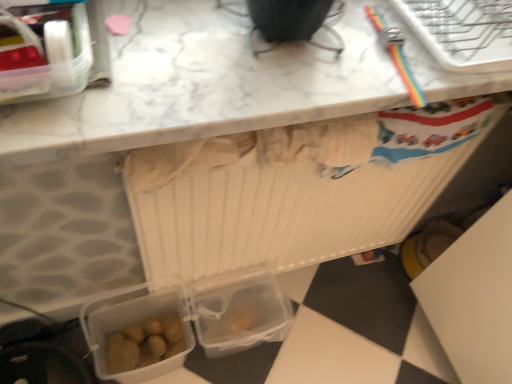
Question: Is rainbow plastic bracelet at upper right positioned beyond the bounds of translucent plastic lunch box at lower left, the 2th lunch box when ordered from back to front?

Choices:
 (A) yes
 (B) no

Answer: (A)

Question: From a real-world perspective, is rainbow plastic bracelet at upper right located higher than translucent plastic lunch box at lower left, the first lunch box positioned from the bottom?

Choices:
 (A) no
 (B) yes

Answer: (B)

Question: Can you confirm if rainbow plastic bracelet at upper right is positioned to the right of translucent plastic lunch box at lower left, the first lunch box positioned from the bottom?

Choices:
 (A) no
 (B) yes

Answer: (B)

Question: From a real-world perspective, is rainbow plastic bracelet at upper right under translucent plastic lunch box at lower left, the 2th lunch box positioned from the front?

Choices:
 (A) no
 (B) yes

Answer: (A)

Question: Does rainbow plastic bracelet at upper right lie in front of translucent plastic lunch box at lower left, the first lunch box positioned from the bottom?

Choices:
 (A) no
 (B) yes

Answer: (B)

Question: Is transparent plastic lunch box at lower center, positioned as the 2th lunch box in bottom-to-top order, to the left or to the right of translucent plastic lunch box at upper left, which is counted as the first lunch box, starting from the top, in the image?

Choices:
 (A) right
 (B) left

Answer: (A)

Question: From their relative heights in the image, would you say transparent plastic lunch box at lower center, which is the second lunch box in top-to-bottom order, is taller or shorter than translucent plastic lunch box at upper left, arranged as the 1th lunch box when viewed from the front?

Choices:
 (A) short
 (B) tall

Answer: (B)

Question: Is transparent plastic lunch box at lower center, positioned as the 2th lunch box in bottom-to-top order, wider or thinner than translucent plastic lunch box at upper left, arranged as the 1th lunch box when viewed from the front?

Choices:
 (A) wide
 (B) thin

Answer: (B)

Question: Looking at the image, does transparent plastic lunch box at lower center, positioned as the 2th lunch box in bottom-to-top order, seem bigger or smaller compared to translucent plastic lunch box at upper left, which is counted as the first lunch box, starting from the top?

Choices:
 (A) small
 (B) big

Answer: (B)

Question: From their relative heights in the image, would you say translucent plastic lunch box at upper left, which is counted as the first lunch box, starting from the top, is taller or shorter than rainbow plastic bracelet at upper right?

Choices:
 (A) tall
 (B) short

Answer: (A)

Question: From the image's perspective, relative to rainbow plastic bracelet at upper right, is translucent plastic lunch box at upper left, arranged as the 1th lunch box when viewed from the front, above or below?

Choices:
 (A) above
 (B) below

Answer: (B)

Question: In terms of width, does translucent plastic lunch box at upper left, the 3th lunch box ordered from the bottom, look wider or thinner when compared to rainbow plastic bracelet at upper right?

Choices:
 (A) wide
 (B) thin

Answer: (B)

Question: From a real-world perspective, is translucent plastic lunch box at upper left, the 3th lunch box from the back, physically located above or below rainbow plastic bracelet at upper right?

Choices:
 (A) below
 (B) above

Answer: (B)

Question: Based on their positions, is translucent plastic lunch box at lower left, the 2th lunch box positioned from the front, located to the left or right of transparent plastic lunch box at lower center, placed as the third lunch box when sorted from front to back?

Choices:
 (A) right
 (B) left

Answer: (B)

Question: In terms of width, does translucent plastic lunch box at lower left, the 2th lunch box when ordered from back to front, look wider or thinner when compared to transparent plastic lunch box at lower center, which is the second lunch box in top-to-bottom order?

Choices:
 (A) thin
 (B) wide

Answer: (A)